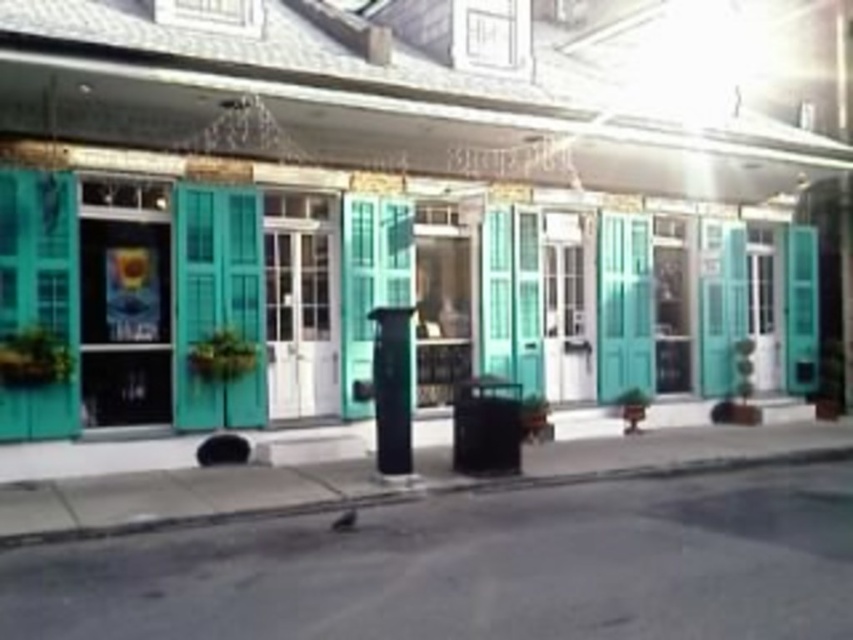
Question: Which object appears farthest from the camera in this image?

Choices:
 (A) concrete at lower left
 (B) teal matte shutters at center

Answer: (B)

Question: Does teal matte shutters at center have a lesser width compared to concrete at lower left?

Choices:
 (A) yes
 (B) no

Answer: (B)

Question: Is teal matte shutters at center wider than concrete at lower left?

Choices:
 (A) no
 (B) yes

Answer: (B)

Question: Does teal matte shutters at center have a lesser width compared to concrete at lower left?

Choices:
 (A) no
 (B) yes

Answer: (A)

Question: Which point is farther from the camera taking this photo?

Choices:
 (A) (550, 484)
 (B) (433, 321)

Answer: (B)